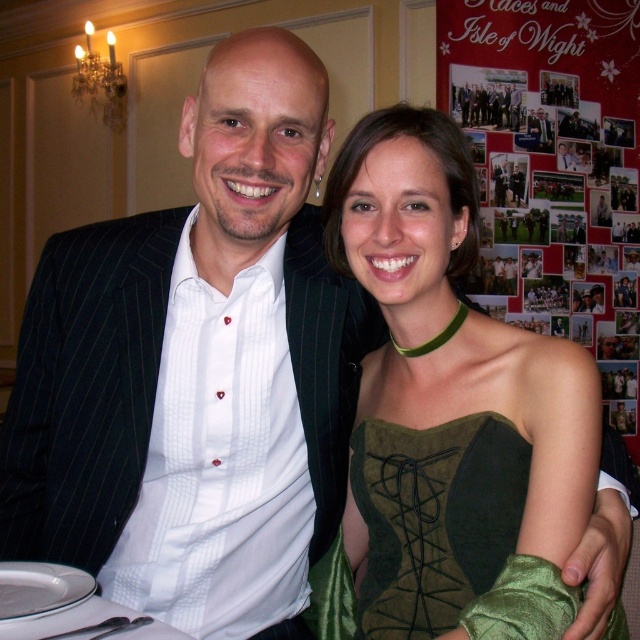
Who is lower down, green suede dress at center or green velvet corset at center?

green velvet corset at center is lower down.

Is point (461, 497) positioned in front of point (506, 476)?

No.

Find the location of a particular element. green suede dress at center is located at coordinates (452, 408).

Between green suede dress at center and matte black suit at center, which one is positioned higher?

matte black suit at center is above.

Is point (339, 257) closer to camera compared to point (545, 136)?

Yes.

In the scene shown: Measure the distance between point (353, 237) and camera.

Point (353, 237) is 39.20 inches away from camera.

The height and width of the screenshot is (640, 640). Identify the location of green suede dress at center. (452, 408).

Based on the photo, is green velvet corset at center positioned before matte black suit at center?

Yes, it is in front of matte black suit at center.

Image resolution: width=640 pixels, height=640 pixels. What do you see at coordinates (435, 518) in the screenshot?
I see `green velvet corset at center` at bounding box center [435, 518].

Is point (369, 520) closer to viewer compared to point (541, 128)?

Yes, point (369, 520) is closer to viewer.

The image size is (640, 640). In order to click on green velvet corset at center in this screenshot , I will do `click(435, 518)`.